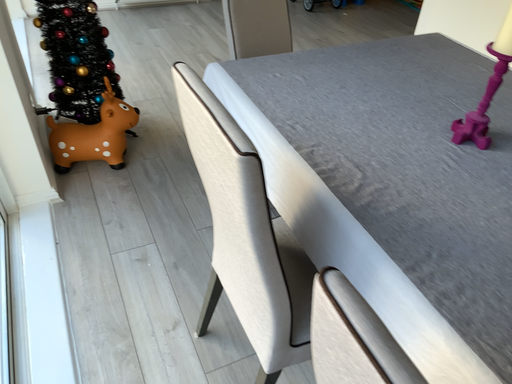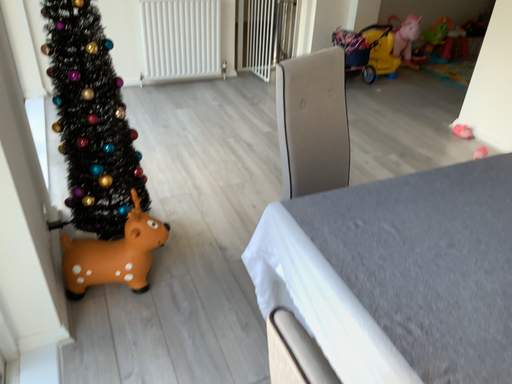
Question: How did the camera likely rotate when shooting the video?

Choices:
 (A) rotated upward
 (B) rotated downward

Answer: (A)